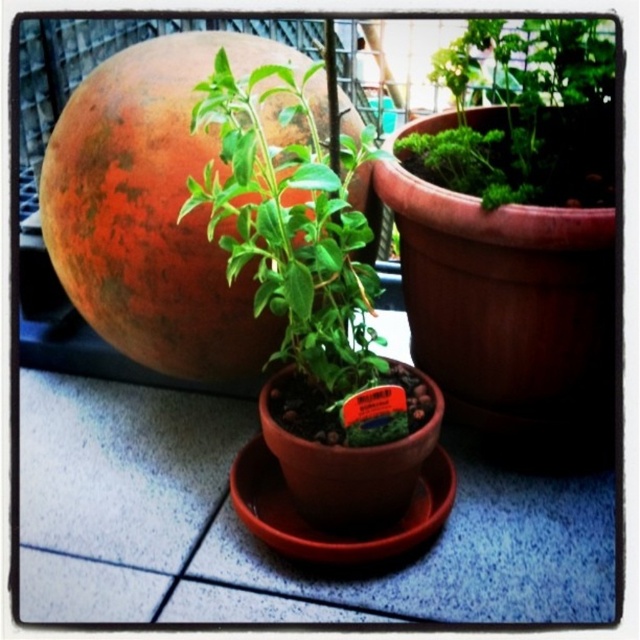
You are designing a garden layout and need to place the matte orange sphere at upper left and the green leafy plant at center in such a way that they are both visible from the entrance. Given their heights, which object should be placed closer to the entrance to ensure both are visible?

The matte orange sphere at upper left is taller than the green leafy plant at center. To ensure both are visible from the entrance, the taller matte orange sphere at upper left should be placed farther back, allowing the shorter green leafy plant at center to be seen in front of it.

Consider the image. You are planning to place a new decorative item on your balcony. You have a matte orange sphere at upper left and a green leafy plant at center. Which one takes up more space in the scene?

The matte orange sphere at upper left is larger in size than the green leafy plant at center, so it takes up more space in the scene.